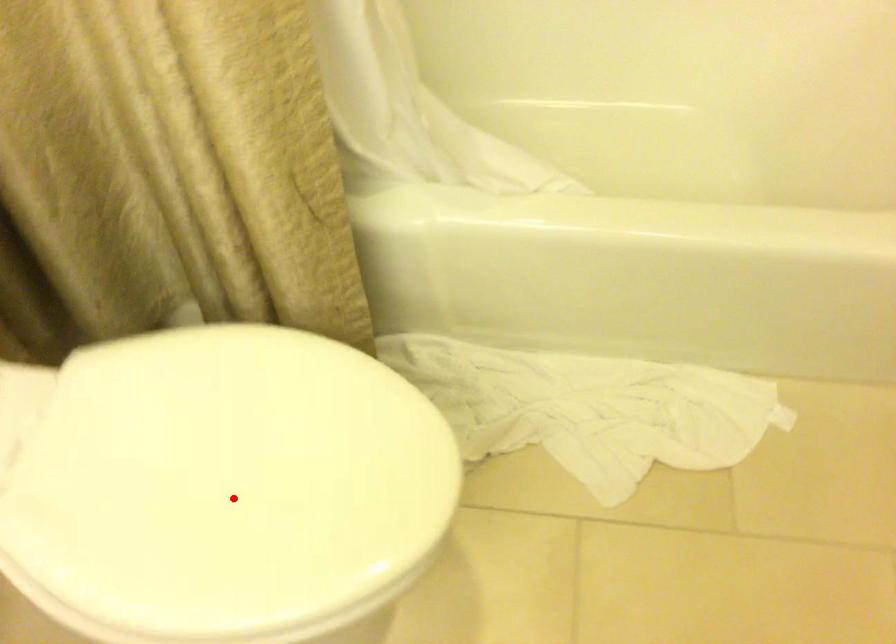
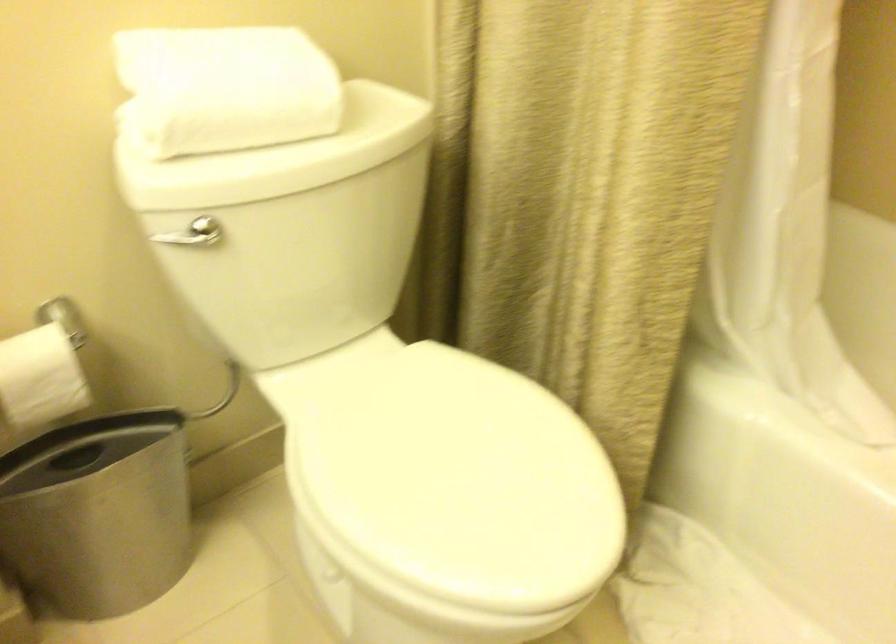
Find the pixel in the second image that matches the highlighted location in the first image.

(442, 485)